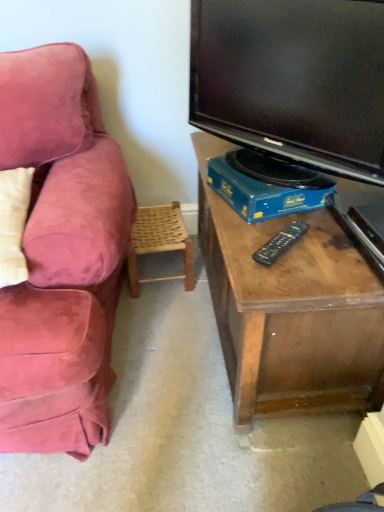
Question: Considering the relative sizes of woven wood chair at lower center and black plastic remote at center in the image provided, is woven wood chair at lower center shorter than black plastic remote at center?

Choices:
 (A) yes
 (B) no

Answer: (B)

Question: From the image's perspective, is woven wood chair at lower center on black plastic remote at center?

Choices:
 (A) yes
 (B) no

Answer: (A)

Question: Is woven wood chair at lower center turned away from black plastic remote at center?

Choices:
 (A) no
 (B) yes

Answer: (A)

Question: Is woven wood chair at lower center positioned behind black plastic remote at center?

Choices:
 (A) no
 (B) yes

Answer: (B)

Question: Is woven wood chair at lower center not within black plastic remote at center?

Choices:
 (A) no
 (B) yes

Answer: (B)

Question: From a real-world perspective, is black plastic remote at center above or below black glossy tv at upper right?

Choices:
 (A) above
 (B) below

Answer: (B)

Question: Is black plastic remote at center to the left or to the right of black glossy tv at upper right in the image?

Choices:
 (A) left
 (B) right

Answer: (A)

Question: In terms of width, does black plastic remote at center look wider or thinner when compared to black glossy tv at upper right?

Choices:
 (A) thin
 (B) wide

Answer: (B)

Question: Is point (289, 240) positioned closer to the camera than point (248, 53)?

Choices:
 (A) closer
 (B) farther

Answer: (A)

Question: From the image's perspective, is black plastic remote at center located above or below woven wood chair at lower center?

Choices:
 (A) below
 (B) above

Answer: (A)

Question: Would you say black plastic remote at center is to the left or to the right of woven wood chair at lower center in the picture?

Choices:
 (A) left
 (B) right

Answer: (B)

Question: From a real-world perspective, is black plastic remote at center above or below woven wood chair at lower center?

Choices:
 (A) above
 (B) below

Answer: (A)

Question: Relative to woven wood chair at lower center, is black plastic remote at center in front or behind?

Choices:
 (A) behind
 (B) front

Answer: (B)

Question: From a real-world perspective, is blue cardboard box at lower center positioned above or below woven wood chair at lower center?

Choices:
 (A) above
 (B) below

Answer: (A)

Question: Is point (279, 210) positioned closer to the camera than point (144, 224)?

Choices:
 (A) farther
 (B) closer

Answer: (B)